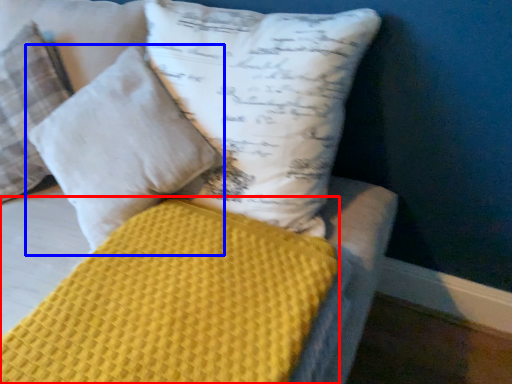
Question: Which of the following is the closest to the observer, mattress (highlighted by a red box) or pillow (highlighted by a blue box)?

Choices:
 (A) mattress
 (B) pillow

Answer: (A)